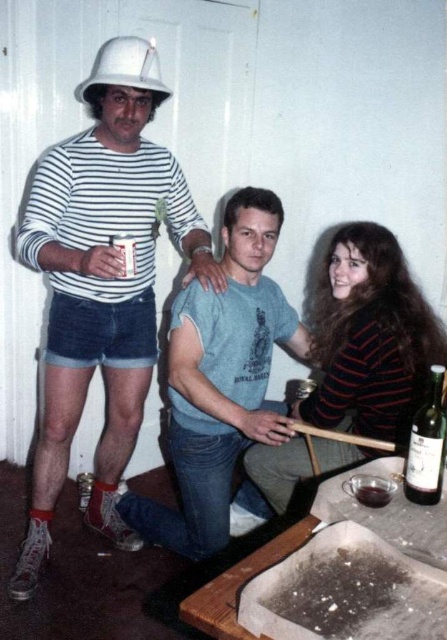
You are an inspector checking safety equipment in a workshop. You notice the white matte hard hat at upper left and the dark glass wine at lower center. Which object is positioned to the left of the other?

The white matte hard hat at upper left is to the left of dark glass wine at lower center.

You are organizing a safety equipment check in the workshop. You have to place the white matte hard hat at left and the dark glass wine at lower center on a shelf. Which object should be placed first to ensure stability?

The white matte hard hat at left should be placed first because it is larger in size than the dark glass wine at lower center, allowing it to provide a stable base for the smaller item.

What are the coordinates of the white matte hard hat at left in the image?

The white matte hard hat at left is located at coordinates point (102,282).